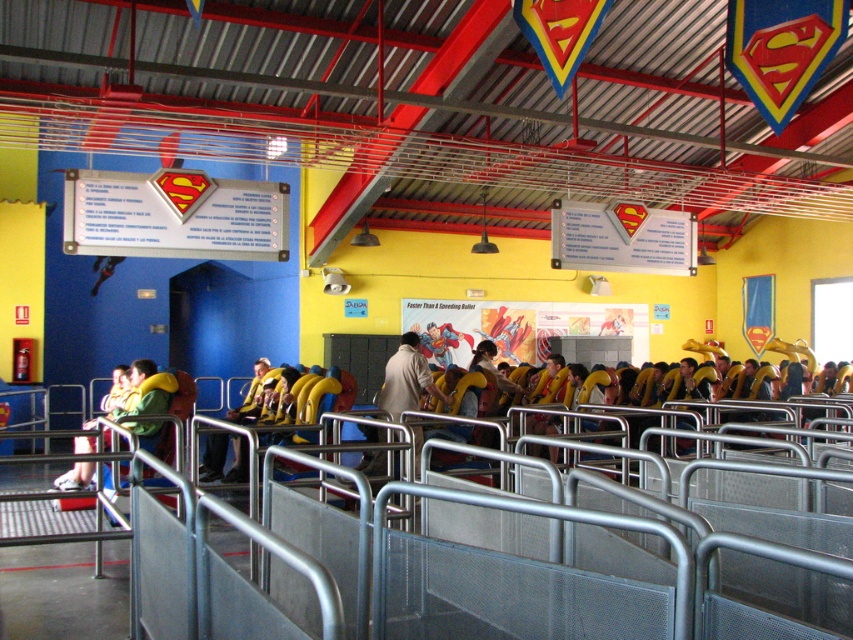
Question: Is metallic silver rail at center thinner than green fabric jacket at center?

Choices:
 (A) no
 (B) yes

Answer: (A)

Question: Which object is farther from the camera taking this photo?

Choices:
 (A) metallic silver rail at center
 (B) light brown leather jacket at center
 (C) green fabric jacket at center
 (D) yellow fabric jacket at center

Answer: (B)

Question: Among these points, which one is farthest from the camera?

Choices:
 (A) (112, 413)
 (B) (273, 385)
 (C) (280, 518)

Answer: (B)

Question: Which point is closer to the camera?

Choices:
 (A) (149, 429)
 (B) (405, 356)

Answer: (A)

Question: Observing the image, what is the correct spatial positioning of metallic silver rail at center in reference to light brown leather jacket at center?

Choices:
 (A) below
 (B) above

Answer: (B)

Question: Is green fabric jacket at center bigger than yellow fabric jacket at center?

Choices:
 (A) no
 (B) yes

Answer: (B)